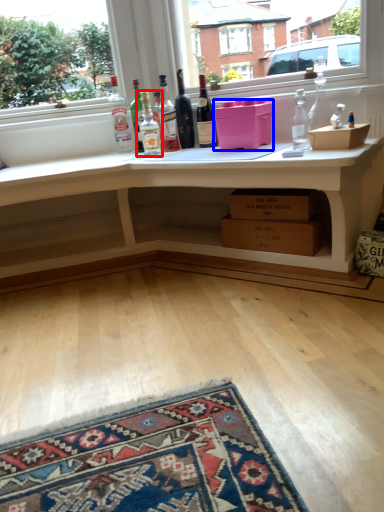
Question: Among these objects, which one is farthest to the camera, bottle (highlighted by a red box) or box (highlighted by a blue box)?

Choices:
 (A) bottle
 (B) box

Answer: (A)